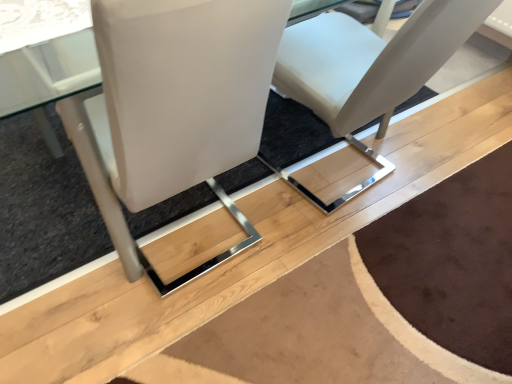
Describe the element at coordinates (173, 107) in the screenshot. I see `white leather chair at center, which is the 1th chair from left to right` at that location.

In order to face white leather chair at center, which is the 1th chair from left to right, should I rotate leftwards or rightwards?

Rotate your view left by about 12.210°.

Where is `white leather chair at center, the 2th chair in the right-to-left sequence`? white leather chair at center, the 2th chair in the right-to-left sequence is located at coordinates (173, 107).

Find the location of a particular element. This screenshot has width=512, height=384. white leather chair at center, arranged as the 1th chair when viewed from the right is located at coordinates (368, 70).

Describe the element at coordinates (368, 70) in the screenshot. The height and width of the screenshot is (384, 512). I see `white leather chair at center, the second chair positioned from the left` at that location.

Measure the distance between white leather chair at center, arranged as the 1th chair when viewed from the right, and camera.

white leather chair at center, arranged as the 1th chair when viewed from the right, is 33.83 inches away from camera.

Based on the photo, what is the approximate width of white leather chair at center, arranged as the 1th chair when viewed from the right?

31.25 inches.

I want to click on white leather chair at center, the 2th chair in the right-to-left sequence, so [x=173, y=107].

Is white leather chair at center, which is the 1th chair from left to right, to the left of white leather chair at center, arranged as the 1th chair when viewed from the right, from the viewer's perspective?

Correct, you'll find white leather chair at center, which is the 1th chair from left to right, to the left of white leather chair at center, arranged as the 1th chair when viewed from the right.

From the picture: Between white leather chair at center, which is the 1th chair from left to right, and white leather chair at center, the second chair positioned from the left, which one is positioned in front?

white leather chair at center, which is the 1th chair from left to right, is in front.

Which is in front, point (226, 75) or point (457, 0)?

The point (226, 75) is closer.

From the image's perspective, between white leather chair at center, which is the 1th chair from left to right, and white leather chair at center, the second chair positioned from the left, which one is located above?

white leather chair at center, the second chair positioned from the left.

From a real-world perspective, between white leather chair at center, which is the 1th chair from left to right, and white leather chair at center, the second chair positioned from the left, who is vertically lower?

white leather chair at center, the second chair positioned from the left.

Can you confirm if white leather chair at center, the 2th chair in the right-to-left sequence, is thinner than white leather chair at center, arranged as the 1th chair when viewed from the right?

Yes, white leather chair at center, the 2th chair in the right-to-left sequence, is thinner than white leather chair at center, arranged as the 1th chair when viewed from the right.

From the picture: Considering the sizes of objects white leather chair at center, which is the 1th chair from left to right, and white leather chair at center, arranged as the 1th chair when viewed from the right, in the image provided, who is shorter, white leather chair at center, which is the 1th chair from left to right, or white leather chair at center, arranged as the 1th chair when viewed from the right,?

white leather chair at center, arranged as the 1th chair when viewed from the right, is shorter.

Looking at the image, does white leather chair at center, the 2th chair in the right-to-left sequence, seem bigger or smaller compared to white leather chair at center, the second chair positioned from the left?

Considering their sizes, white leather chair at center, the 2th chair in the right-to-left sequence, takes up less space than white leather chair at center, the second chair positioned from the left.

Do you think white leather chair at center, the 2th chair in the right-to-left sequence, is within white leather chair at center, arranged as the 1th chair when viewed from the right, or outside of it?

white leather chair at center, the 2th chair in the right-to-left sequence, is located beyond the bounds of white leather chair at center, arranged as the 1th chair when viewed from the right.

Consider the image. Is white leather chair at center, which is the 1th chair from left to right, not near white leather chair at center, the second chair positioned from the left?

white leather chair at center, which is the 1th chair from left to right, is near white leather chair at center, the second chair positioned from the left, not far away.

In the scene shown: Is white leather chair at center, which is the 1th chair from left to right, positioned with its back to white leather chair at center, the second chair positioned from the left?

That's not correct — white leather chair at center, which is the 1th chair from left to right, is not looking away from white leather chair at center, the second chair positioned from the left.

How many degrees apart are the facing directions of white leather chair at center, the 2th chair in the right-to-left sequence, and white leather chair at center, the second chair positioned from the left?

The angle between the facing direction of white leather chair at center, the 2th chair in the right-to-left sequence, and the facing direction of white leather chair at center, the second chair positioned from the left, is 3.28 degrees.

How distant is white leather chair at center, the 2th chair in the right-to-left sequence, from white leather chair at center, arranged as the 1th chair when viewed from the right?

white leather chair at center, the 2th chair in the right-to-left sequence, is 18.15 inches away from white leather chair at center, arranged as the 1th chair when viewed from the right.

Identify the location of chair behind the white leather chair at center, which is the 1th chair from left to right. The height and width of the screenshot is (384, 512). (368, 70).

Considering the positions of objects white leather chair at center, arranged as the 1th chair when viewed from the right, and white leather chair at center, which is the 1th chair from left to right, in the image provided, who is more to the right, white leather chair at center, arranged as the 1th chair when viewed from the right, or white leather chair at center, which is the 1th chair from left to right,?

white leather chair at center, arranged as the 1th chair when viewed from the right.

Is white leather chair at center, the second chair positioned from the left, further to camera compared to white leather chair at center, which is the 1th chair from left to right?

That is True.

Does point (307, 57) appear closer or farther from the camera than point (147, 141)?

Point (307, 57).

From the image's perspective, is white leather chair at center, the second chair positioned from the left, located beneath white leather chair at center, the 2th chair in the right-to-left sequence?

Incorrect, from the image's perspective, white leather chair at center, the second chair positioned from the left, is higher than white leather chair at center, the 2th chair in the right-to-left sequence.

In the scene shown: From a real-world perspective, is white leather chair at center, arranged as the 1th chair when viewed from the right, above or below white leather chair at center, the 2th chair in the right-to-left sequence?

white leather chair at center, arranged as the 1th chair when viewed from the right, is below white leather chair at center, the 2th chair in the right-to-left sequence.

Is white leather chair at center, the second chair positioned from the left, thinner than white leather chair at center, the 2th chair in the right-to-left sequence?

No, white leather chair at center, the second chair positioned from the left, is not thinner than white leather chair at center, the 2th chair in the right-to-left sequence.

Does white leather chair at center, arranged as the 1th chair when viewed from the right, have a greater height compared to white leather chair at center, the 2th chair in the right-to-left sequence?

Incorrect, the height of white leather chair at center, arranged as the 1th chair when viewed from the right, is not larger of that of white leather chair at center, the 2th chair in the right-to-left sequence.

In the scene shown: Is white leather chair at center, arranged as the 1th chair when viewed from the right, bigger than white leather chair at center, which is the 1th chair from left to right?

Indeed, white leather chair at center, arranged as the 1th chair when viewed from the right, has a larger size compared to white leather chair at center, which is the 1th chair from left to right.

Would you say white leather chair at center, arranged as the 1th chair when viewed from the right, is outside white leather chair at center, the 2th chair in the right-to-left sequence?

Indeed, white leather chair at center, arranged as the 1th chair when viewed from the right, is completely outside white leather chair at center, the 2th chair in the right-to-left sequence.

Is white leather chair at center, arranged as the 1th chair when viewed from the right, next to white leather chair at center, the 2th chair in the right-to-left sequence?

No, white leather chair at center, arranged as the 1th chair when viewed from the right, is not in contact with white leather chair at center, the 2th chair in the right-to-left sequence.

Is white leather chair at center, arranged as the 1th chair when viewed from the right, oriented away from white leather chair at center, which is the 1th chair from left to right?

white leather chair at center, arranged as the 1th chair when viewed from the right, is not turned away from white leather chair at center, which is the 1th chair from left to right.

How different are the orientations of white leather chair at center, the second chair positioned from the left, and white leather chair at center, which is the 1th chair from left to right, in degrees?

3.28 degrees separate the facing orientations of white leather chair at center, the second chair positioned from the left, and white leather chair at center, which is the 1th chair from left to right.

You are a GUI agent. You are given a task and a screenshot of the screen. Output one action in this format:
    pyautogui.click(x=<x>, y=<y>)
    Task: Click on the chair below the white leather chair at center, which is the 1th chair from left to right (from a real-world perspective)
    
    Given the screenshot: What is the action you would take?
    pyautogui.click(x=368, y=70)

Where is `chair above the white leather chair at center, arranged as the 1th chair when viewed from the right (from a real-world perspective)`? chair above the white leather chair at center, arranged as the 1th chair when viewed from the right (from a real-world perspective) is located at coordinates (173, 107).

This screenshot has height=384, width=512. Find the location of `chair on the right of the white leather chair at center, the 2th chair in the right-to-left sequence`. chair on the right of the white leather chair at center, the 2th chair in the right-to-left sequence is located at coordinates (368, 70).